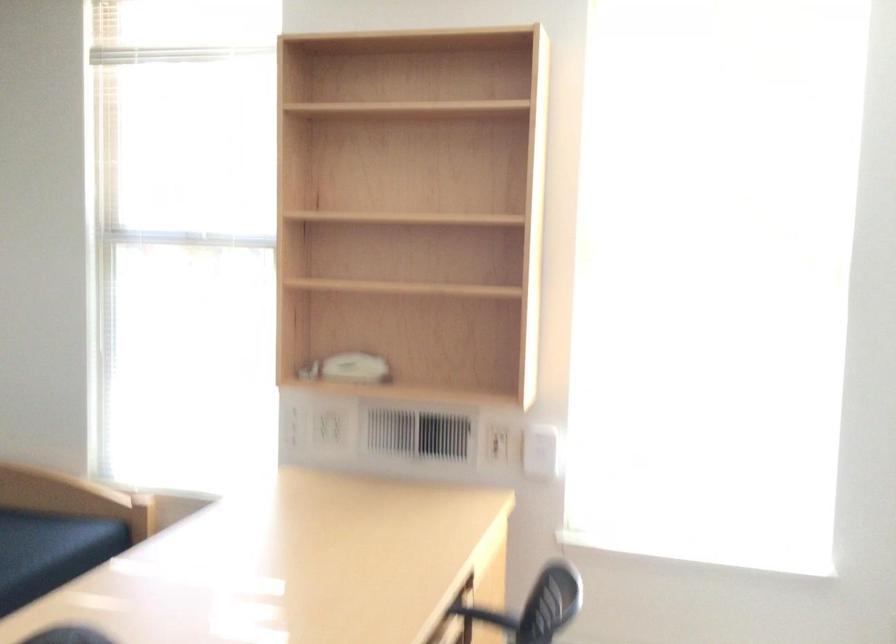
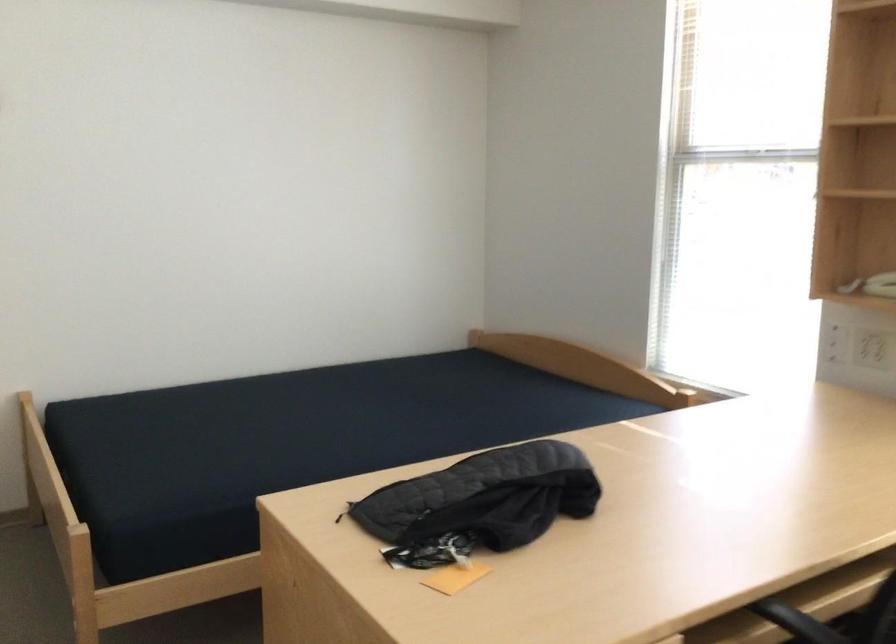
Question: The camera is either moving clockwise (left) or counter-clockwise (right) around the object. The first image is from the beginning of the video and the second image is from the end. Is the camera moving left or right when shooting the video?

Choices:
 (A) Left
 (B) Right

Answer: (B)